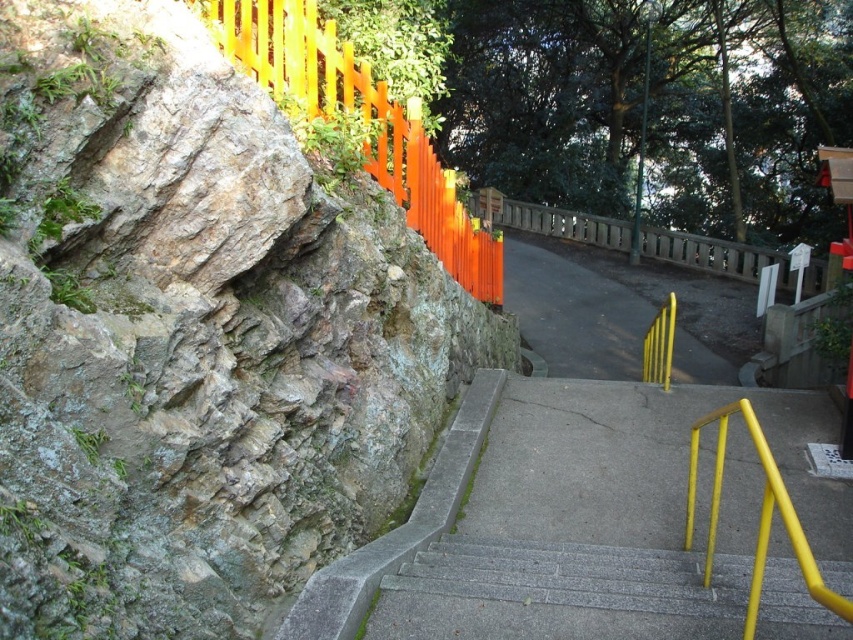
Who is positioned more to the right, gray concrete stairs at center or orange painted wood fence at upper left?

gray concrete stairs at center

Which is behind, point (491, 579) or point (331, 65)?

Point (331, 65)

Where is `gray concrete stairs at center`? gray concrete stairs at center is located at coordinates (560, 593).

Between rocky cliff at left and wooden at upper center, which one is positioned lower?

Positioned lower is rocky cliff at left.

Is rocky cliff at left further to camera compared to wooden at upper center?

No, it is in front of wooden at upper center.

You are a GUI agent. You are given a task and a screenshot of the screen. Output one action in this format:
    pyautogui.click(x=<x>, y=<y>)
    Task: Click on the rocky cliff at left
    The width and height of the screenshot is (853, 640).
    Given the screenshot: What is the action you would take?
    pyautogui.click(x=194, y=337)

Looking at this image, can you confirm if rocky cliff at left is smaller than orange painted wood fence at upper left?

Incorrect, rocky cliff at left is not smaller in size than orange painted wood fence at upper left.

Can you confirm if rocky cliff at left is positioned above orange painted wood fence at upper left?

No, rocky cliff at left is not above orange painted wood fence at upper left.

Is point (61, 288) closer to viewer compared to point (416, 109)?

Yes, it is.

Identify the location of rocky cliff at left. This screenshot has height=640, width=853. (194, 337).